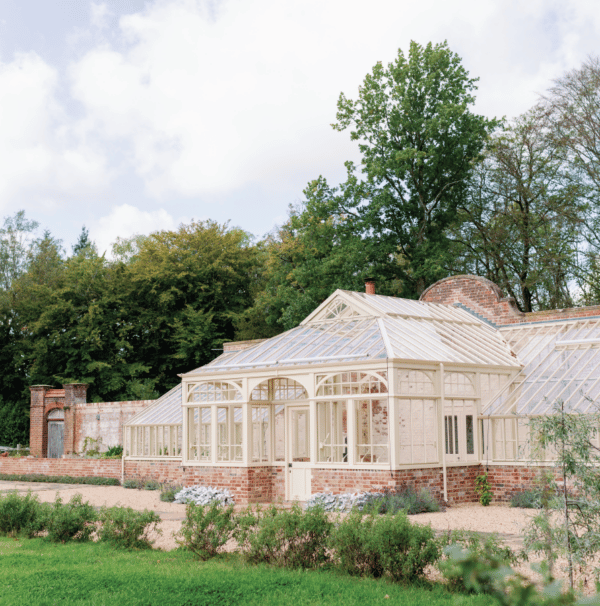
In order to click on 1 front door in center in this screenshot , I will do `click(297, 465)`.